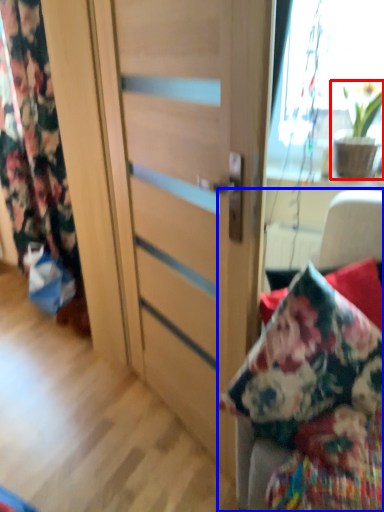
Question: Among these objects, which one is farthest to the camera, houseplant (highlighted by a red box) or furniture (highlighted by a blue box)?

Choices:
 (A) houseplant
 (B) furniture

Answer: (A)